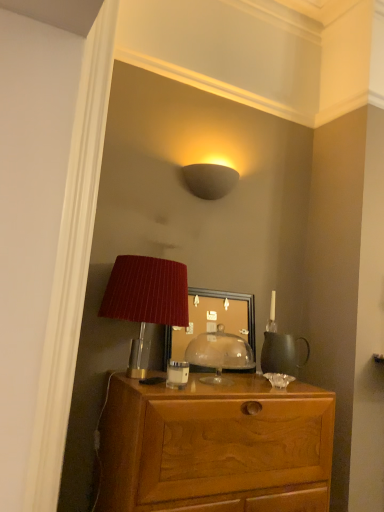
Question: From the image's perspective, is white glossy coffee cup at center on top of wooden desk at center?

Choices:
 (A) no
 (B) yes

Answer: (B)

Question: Does white glossy coffee cup at center have a larger size compared to wooden desk at center?

Choices:
 (A) no
 (B) yes

Answer: (A)

Question: Is white glossy coffee cup at center completely or partially outside of wooden desk at center?

Choices:
 (A) yes
 (B) no

Answer: (A)

Question: Could wooden desk at center be considered to be inside white glossy coffee cup at center?

Choices:
 (A) yes
 (B) no

Answer: (B)

Question: Is white glossy coffee cup at center to the left of wooden desk at center from the viewer's perspective?

Choices:
 (A) yes
 (B) no

Answer: (A)

Question: Is white glossy coffee cup at center facing towards wooden desk at center?

Choices:
 (A) yes
 (B) no

Answer: (B)

Question: Is matte glass mirror at center aimed at matte red lampshade at center?

Choices:
 (A) no
 (B) yes

Answer: (B)

Question: Considering the relative sizes of matte glass mirror at center and matte red lampshade at center in the image provided, is matte glass mirror at center taller than matte red lampshade at center?

Choices:
 (A) no
 (B) yes

Answer: (B)

Question: From the image's perspective, is matte glass mirror at center on top of matte red lampshade at center?

Choices:
 (A) no
 (B) yes

Answer: (B)

Question: Is matte glass mirror at center outside matte red lampshade at center?

Choices:
 (A) no
 (B) yes

Answer: (B)

Question: Can you confirm if matte glass mirror at center is bigger than matte red lampshade at center?

Choices:
 (A) yes
 (B) no

Answer: (A)

Question: Can you confirm if matte glass mirror at center is thinner than matte red lampshade at center?

Choices:
 (A) yes
 (B) no

Answer: (A)

Question: From a real-world perspective, is matte red lampshade at center on top of white glossy coffee cup at center?

Choices:
 (A) no
 (B) yes

Answer: (B)